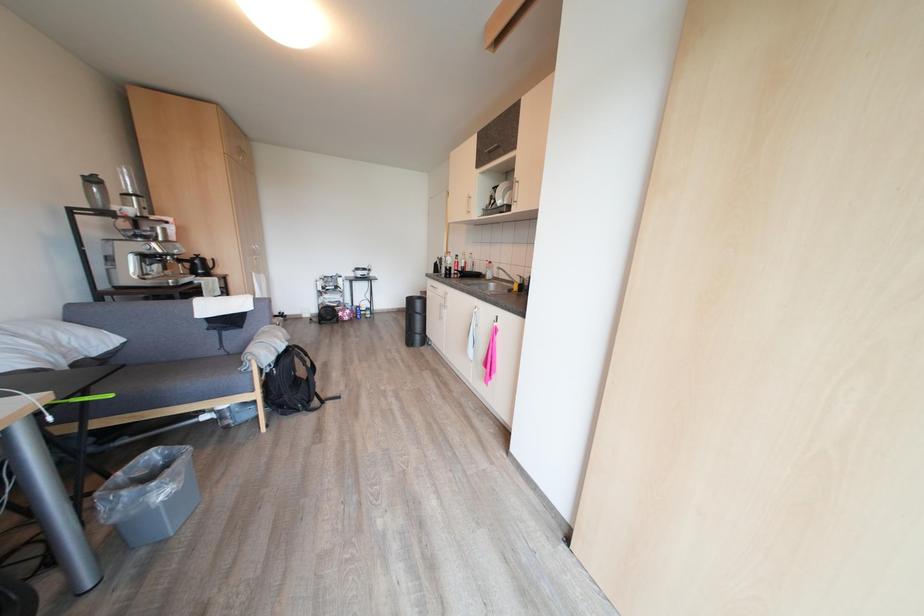
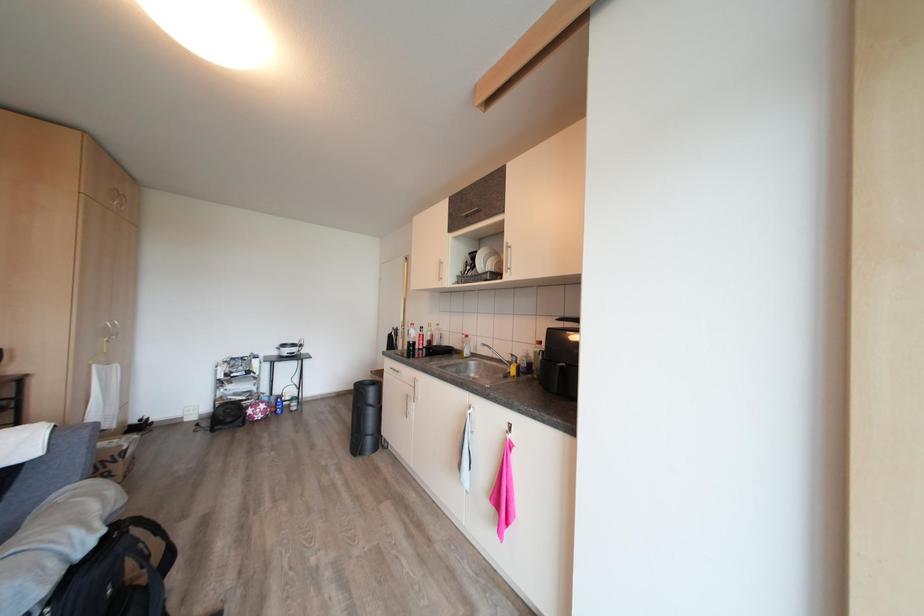
What movement of the cameraman would produce the second image?

The movement direction of the cameraman is left, forward.